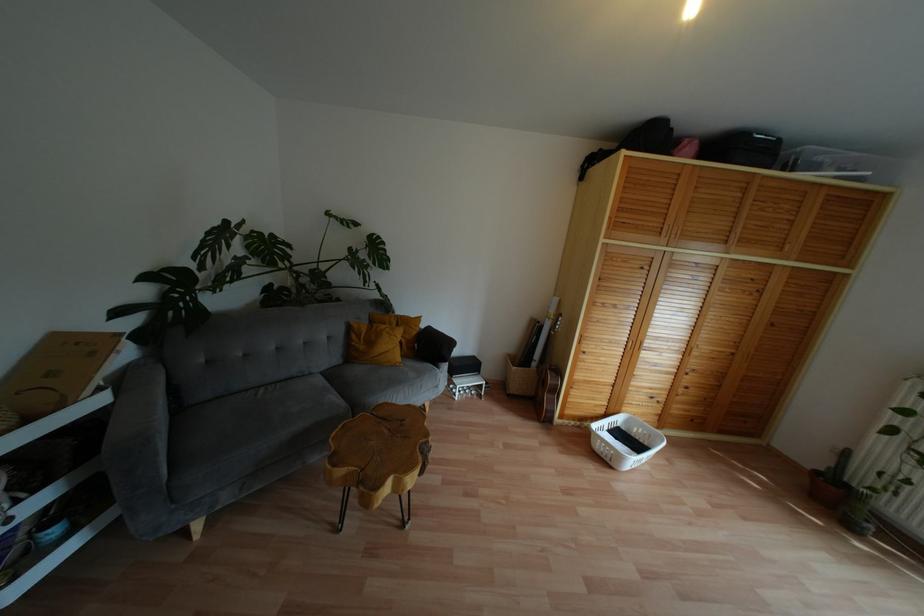
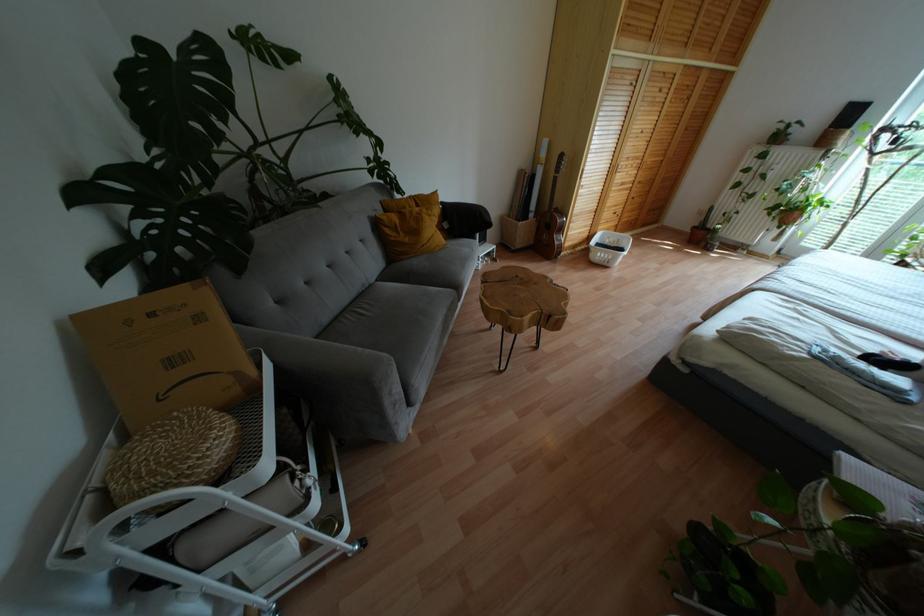
Locate, in the second image, the point that corresponds to point 819,472 in the first image.

(694, 227)